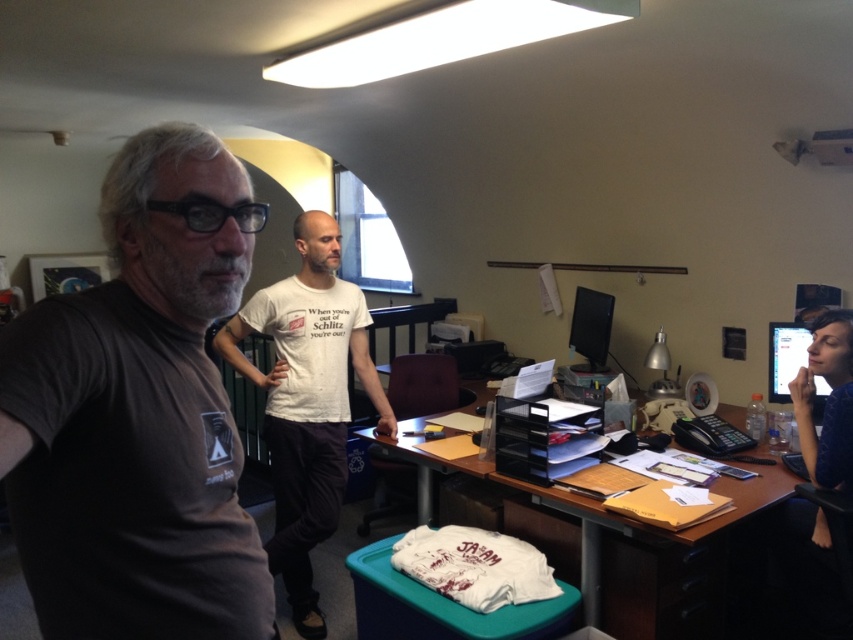
You are a delivery person who just arrived at an office. You need to place a package between the blue fabric shirt at lower right and the matte black monitor at right. The package is 16 inches long. Can you fit it between them?

The blue fabric shirt at lower right and matte black monitor at right are 15.52 inches apart. Since the package is 16 inches long, it cannot fit between them as the space is slightly smaller than the package.

From the picture: You are a delivery person who needs to place a package on the wooden desk at center. The package is 24 inches wide. Can you fit it on the desk without overlapping the matte black monitor at right?

The distance between the wooden desk at center and the matte black monitor at right is 22.32 inches. Since the package is 24 inches wide, it would overlap the monitor if placed on the desk. Therefore, the package cannot be placed without overlapping.